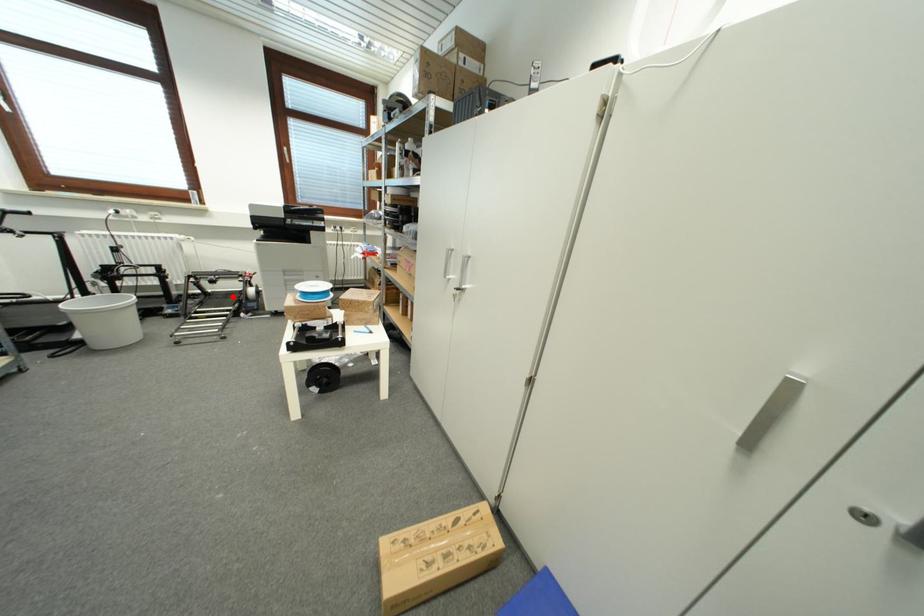
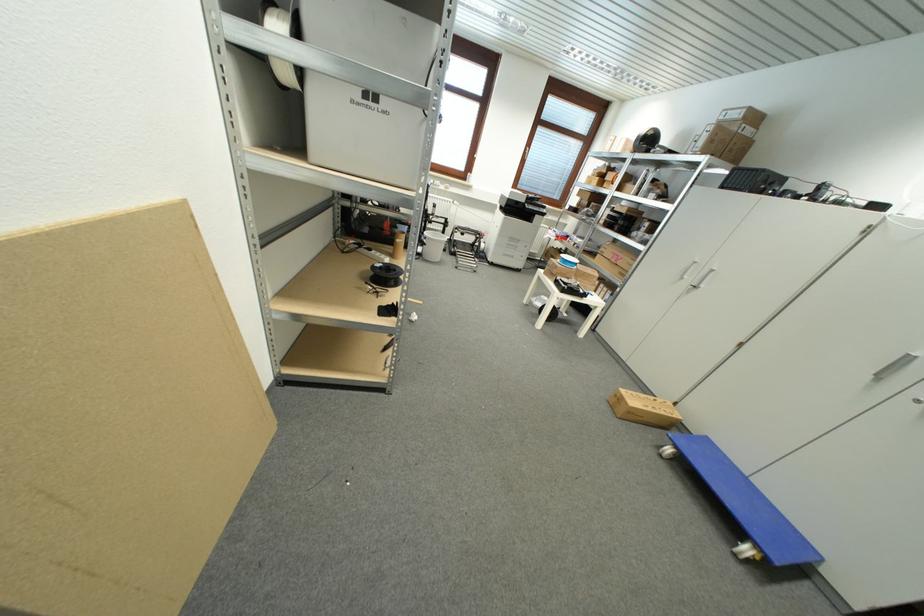
Locate, in the second image, the point that corresponds to the highlighted location in the first image.

(468, 246)